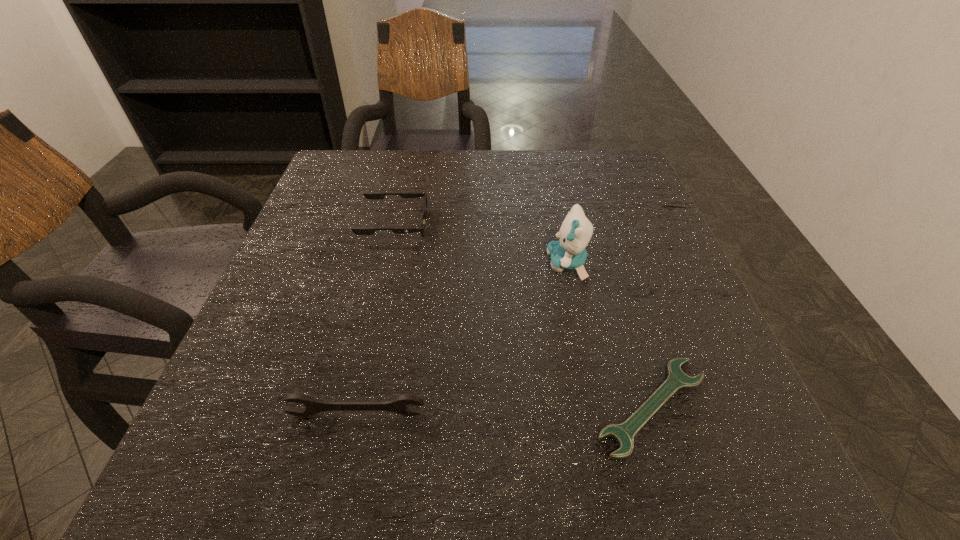
The image size is (960, 540). In order to click on the third nearest object in this screenshot , I will do `click(568, 253)`.

Where is `kitten`? This screenshot has width=960, height=540. kitten is located at coordinates (568, 253).

You are a GUI agent. You are given a task and a screenshot of the screen. Output one action in this format:
    pyautogui.click(x=<x>, y=<y>)
    Task: Click on the left wrench
    The image size is (960, 540).
    Given the screenshot: What is the action you would take?
    pyautogui.click(x=399, y=404)

Where is `the second tallest object`? the second tallest object is located at coordinates pos(399,404).

The width and height of the screenshot is (960, 540). What are the coordinates of `sunglasses` in the screenshot? It's located at (369, 195).

Where is `the farthest object`? Image resolution: width=960 pixels, height=540 pixels. the farthest object is located at coordinates (369, 195).

The image size is (960, 540). I want to click on the shortest object, so click(x=624, y=433).

This screenshot has width=960, height=540. I want to click on the shorter wrench, so click(x=624, y=433).

At what (x,y) coordinates should I click in order to perform the action: click on free spot located on the face of the third nearest object. Please return your answer as a coordinate pair (x, y). This screenshot has height=540, width=960. Looking at the image, I should click on (483, 264).

The image size is (960, 540). In order to click on free location located 0.220m on the face of the third nearest object in this screenshot , I will do `click(440, 264)`.